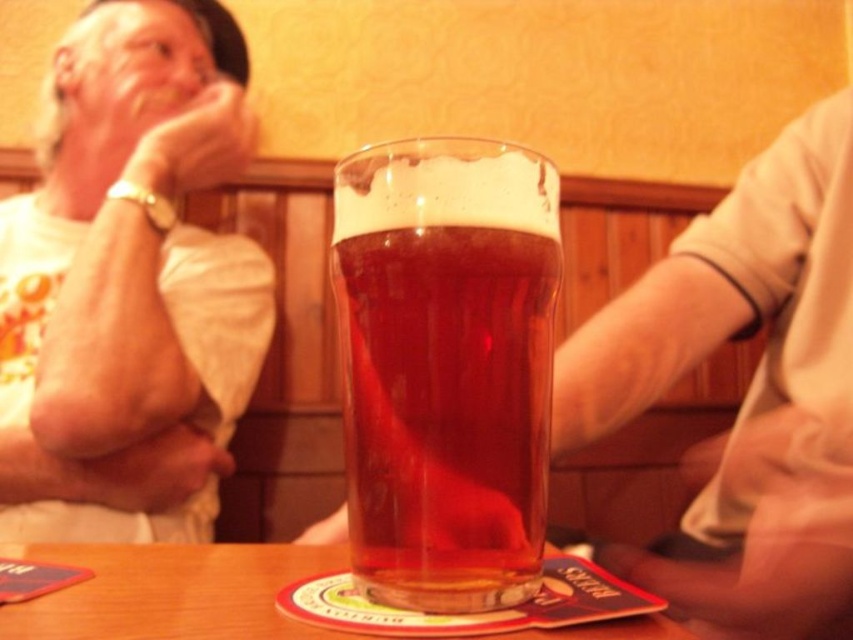
Question: Which object is positioned farthest from the translucent glass beer at center?

Choices:
 (A) white cotton shirt at upper left
 (B) wooden table at center

Answer: (A)

Question: Which of these objects is positioned closest to the translucent glass beer at center?

Choices:
 (A) wooden table at center
 (B) white cotton shirt at upper left

Answer: (A)

Question: Does white cotton shirt at upper left appear on the right side of wooden table at center?

Choices:
 (A) yes
 (B) no

Answer: (B)

Question: Does white cotton shirt at upper left come behind wooden table at center?

Choices:
 (A) no
 (B) yes

Answer: (B)

Question: Which object is positioned farthest from the translucent glass beer at center?

Choices:
 (A) white cotton shirt at upper left
 (B) wooden table at center

Answer: (A)

Question: Is white cotton shirt at upper left positioned before wooden table at center?

Choices:
 (A) no
 (B) yes

Answer: (A)